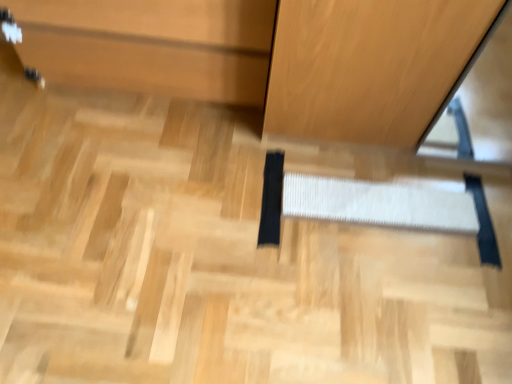
Image resolution: width=512 pixels, height=384 pixels. In order to click on white woven stair at center in this screenshot , I will do `click(378, 204)`.

The image size is (512, 384). Describe the element at coordinates (378, 204) in the screenshot. I see `white woven stair at center` at that location.

Measure the distance between white woven stair at center and camera.

white woven stair at center is 4.21 feet away from camera.

What do you see at coordinates (151, 45) in the screenshot? I see `matte wood cabinet at upper left` at bounding box center [151, 45].

Find the location of a particular element. matte wood cabinet at upper left is located at coordinates point(151,45).

Image resolution: width=512 pixels, height=384 pixels. I want to click on white woven stair at center, so click(378, 204).

Based on the photo, does white woven stair at center appear on the left side of matte wood cabinet at upper left?

In fact, white woven stair at center is to the right of matte wood cabinet at upper left.

Between white woven stair at center and matte wood cabinet at upper left, which one is positioned in front?

Positioned in front is matte wood cabinet at upper left.

Which is closer, (450, 224) or (106, 73)?

Point (450, 224) is closer to the camera than point (106, 73).

From the image's perspective, between white woven stair at center and matte wood cabinet at upper left, who is located below?

white woven stair at center appears lower in the image.

From a real-world perspective, is white woven stair at center on matte wood cabinet at upper left?

Incorrect, from a real-world perspective, white woven stair at center is lower than matte wood cabinet at upper left.

Which object is wider, white woven stair at center or matte wood cabinet at upper left?

matte wood cabinet at upper left.

Which of these two, white woven stair at center or matte wood cabinet at upper left, stands shorter?

With less height is white woven stair at center.

Is white woven stair at center smaller than matte wood cabinet at upper left?

Yes, white woven stair at center is smaller than matte wood cabinet at upper left.

Can matte wood cabinet at upper left be found inside white woven stair at center?

No, matte wood cabinet at upper left is not inside white woven stair at center.

Is white woven stair at center not close to matte wood cabinet at upper left?

white woven stair at center is actually quite close to matte wood cabinet at upper left.

Is matte wood cabinet at upper left at the back of white woven stair at center?

white woven stair at center is not turned away from matte wood cabinet at upper left.

You are a GUI agent. You are given a task and a screenshot of the screen. Output one action in this format:
    pyautogui.click(x=<x>, y=<y>)
    Task: Click on the stair located underneath the matte wood cabinet at upper left (from a real-world perspective)
    
    Given the screenshot: What is the action you would take?
    pyautogui.click(x=378, y=204)

Which object is positioned more to the left, matte wood cabinet at upper left or white woven stair at center?

matte wood cabinet at upper left is more to the left.

Which object is closer to the camera, matte wood cabinet at upper left or white woven stair at center?

matte wood cabinet at upper left.

Is point (151, 79) in front of point (403, 208)?

No.

From the image's perspective, is matte wood cabinet at upper left on top of white woven stair at center?

Yes.

From a real-world perspective, is matte wood cabinet at upper left beneath white woven stair at center?

Incorrect, from a real-world perspective, matte wood cabinet at upper left is higher than white woven stair at center.

Can you confirm if matte wood cabinet at upper left is wider than white woven stair at center?

Yes.

Consider the image. Is matte wood cabinet at upper left taller than white woven stair at center?

Indeed, matte wood cabinet at upper left has a greater height compared to white woven stair at center.

Can you confirm if matte wood cabinet at upper left is bigger than white woven stair at center?

Yes.

Is matte wood cabinet at upper left situated inside white woven stair at center or outside?

matte wood cabinet at upper left is outside white woven stair at center.

Is matte wood cabinet at upper left positioned far away from white woven stair at center?

No.

Is matte wood cabinet at upper left aimed at white woven stair at center?

No.

Measure the distance from matte wood cabinet at upper left to white woven stair at center.

22.80 inches.

You are a GUI agent. You are given a task and a screenshot of the screen. Output one action in this format:
    pyautogui.click(x=<x>, y=<y>)
    Task: Click on the cabinetry above the white woven stair at center (from a real-world perspective)
    The width and height of the screenshot is (512, 384).
    Given the screenshot: What is the action you would take?
    pyautogui.click(x=151, y=45)

In the image, there is a matte wood cabinet at upper left. In order to click on stair below it (from the image's perspective) in this screenshot , I will do `click(378, 204)`.

Identify the location of cabinetry located on the left of white woven stair at center. This screenshot has width=512, height=384. (151, 45).